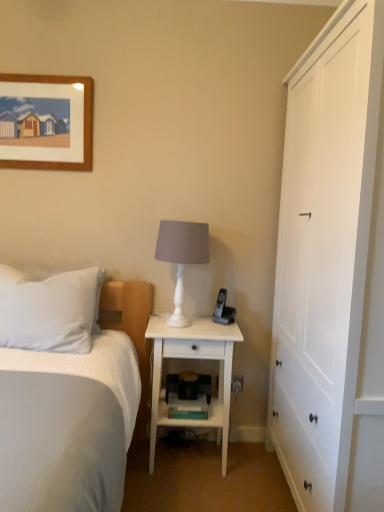
Locate an element on the screen. Image resolution: width=384 pixels, height=512 pixels. free space in front of black plastic phone at right is located at coordinates (215, 330).